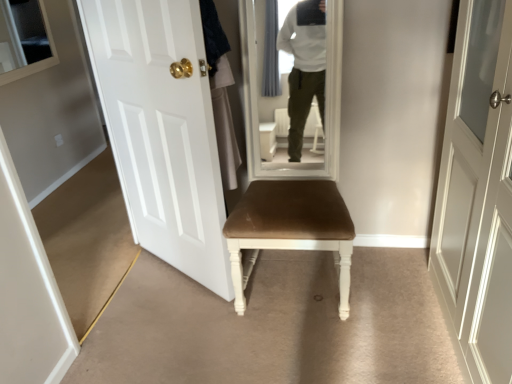
Identify the location of free space underneath brown velvet chair at center (from a real-world perspective). This screenshot has height=384, width=512. coord(295,279).